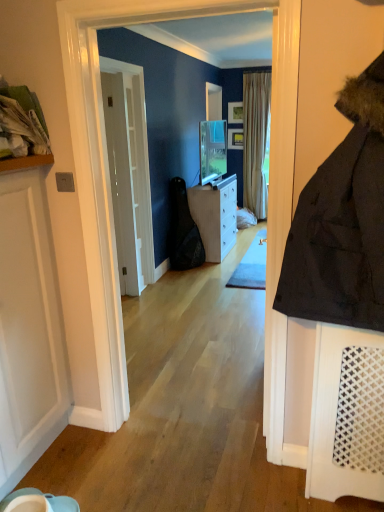
Question: Is striped fabric curtain at center shorter than white matte door at left, the 1th door viewed from the front?

Choices:
 (A) no
 (B) yes

Answer: (A)

Question: Is striped fabric curtain at center outside of white matte door at left, marked as the 2th door in a back-to-front arrangement?

Choices:
 (A) no
 (B) yes

Answer: (B)

Question: From the image's perspective, would you say striped fabric curtain at center is shown under white matte door at left, marked as the 2th door in a back-to-front arrangement?

Choices:
 (A) yes
 (B) no

Answer: (B)

Question: Is striped fabric curtain at center to the left of white matte door at left, marked as the 2th door in a back-to-front arrangement, from the viewer's perspective?

Choices:
 (A) no
 (B) yes

Answer: (A)

Question: From a real-world perspective, is striped fabric curtain at center positioned under white matte door at left, marked as the 2th door in a back-to-front arrangement, based on gravity?

Choices:
 (A) no
 (B) yes

Answer: (A)

Question: In terms of height, does striped fabric curtain at center look taller or shorter compared to white glossy door at center, the second door viewed from the front?

Choices:
 (A) tall
 (B) short

Answer: (A)

Question: Does point (248, 192) appear closer or farther from the camera than point (107, 145)?

Choices:
 (A) farther
 (B) closer

Answer: (A)

Question: Based on their sizes in the image, would you say striped fabric curtain at center is bigger or smaller than white glossy door at center, the first door when ordered from back to front?

Choices:
 (A) big
 (B) small

Answer: (A)

Question: Is striped fabric curtain at center spatially inside white glossy door at center, the second door viewed from the front, or outside of it?

Choices:
 (A) outside
 (B) inside

Answer: (A)

Question: Considering the positions of white glossy door at center, the second door viewed from the front, and white fabric laundry at upper left in the image, is white glossy door at center, the second door viewed from the front, taller or shorter than white fabric laundry at upper left?

Choices:
 (A) tall
 (B) short

Answer: (A)

Question: Does point (132, 281) appear closer or farther from the camera than point (28, 112)?

Choices:
 (A) farther
 (B) closer

Answer: (A)

Question: Visually, is white glossy door at center, the second door viewed from the front, positioned to the left or to the right of white fabric laundry at upper left?

Choices:
 (A) right
 (B) left

Answer: (A)

Question: From a real-world perspective, is white glossy door at center, the first door when ordered from back to front, above or below white fabric laundry at upper left?

Choices:
 (A) below
 (B) above

Answer: (A)

Question: Based on their positions, is white matte door at left, the 1th door viewed from the front, located to the left or right of white fabric laundry at upper left?

Choices:
 (A) right
 (B) left

Answer: (A)

Question: From a real-world perspective, is white matte door at left, marked as the 2th door in a back-to-front arrangement, above or below white fabric laundry at upper left?

Choices:
 (A) above
 (B) below

Answer: (B)